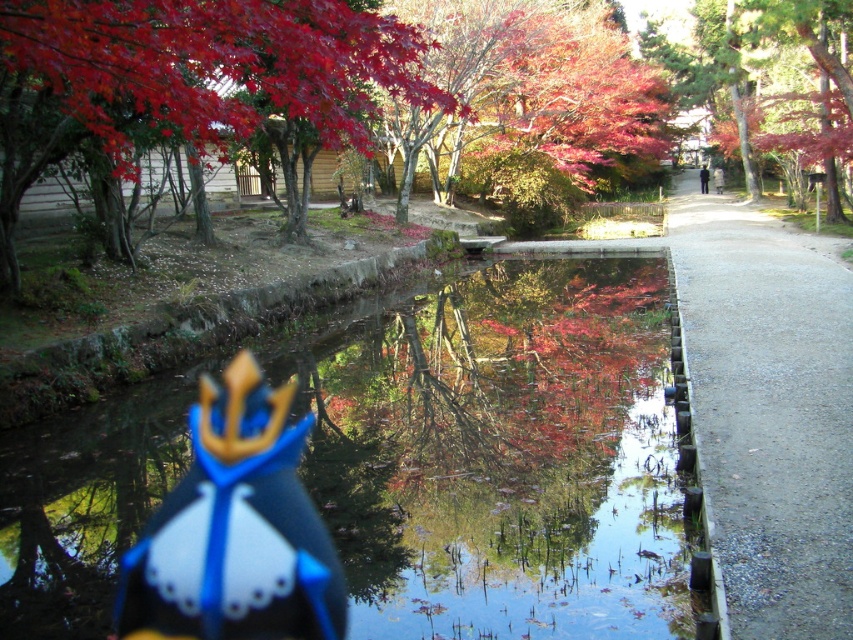
Question: Considering the real-world distances, which object is closest to the blue fabric toy at center?

Choices:
 (A) gravelly gray path at right
 (B) transparent plastic puddle at center

Answer: (B)

Question: In this image, where is gravelly gray path at right located relative to blue fabric toy at center?

Choices:
 (A) right
 (B) left

Answer: (A)

Question: Among these points, which one is nearest to the camera?

Choices:
 (A) (543, 435)
 (B) (807, 253)

Answer: (A)

Question: Which point is closer to the camera?

Choices:
 (A) (508, 289)
 (B) (277, 524)

Answer: (B)

Question: Does transparent plastic puddle at center have a greater width compared to blue fabric toy at center?

Choices:
 (A) yes
 (B) no

Answer: (A)

Question: Is transparent plastic puddle at center wider than gravelly gray path at right?

Choices:
 (A) no
 (B) yes

Answer: (A)